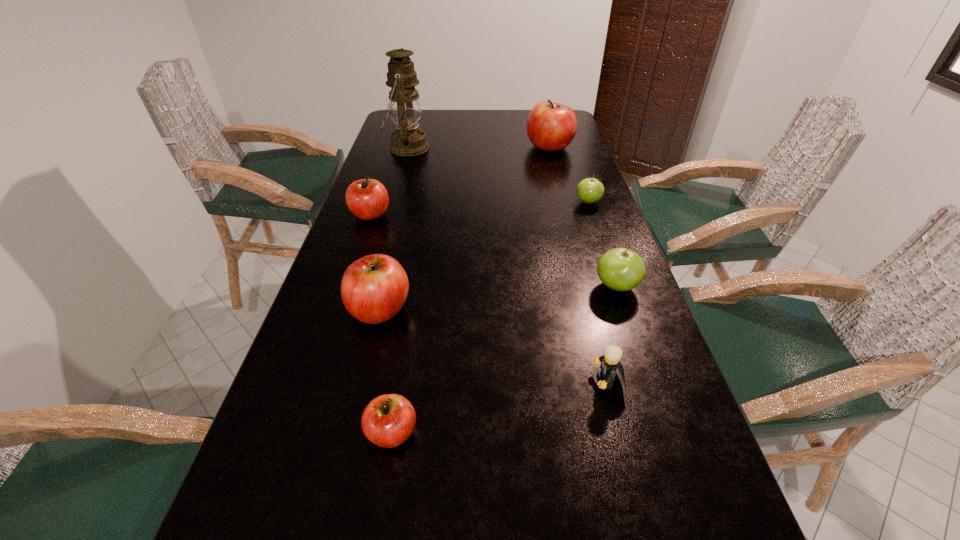
The image size is (960, 540). I want to click on free space in the image that satisfies the following two spatial constraints: 1. on the back side of the third nearest red apple; 2. on the left side of the second tallest object, so click(x=394, y=147).

Where is `vacant space that satisfies the following two spatial constraints: 1. on the front side of the second tallest apple; 2. on the right side of the nearest red apple`? Image resolution: width=960 pixels, height=540 pixels. vacant space that satisfies the following two spatial constraints: 1. on the front side of the second tallest apple; 2. on the right side of the nearest red apple is located at coordinates (350, 433).